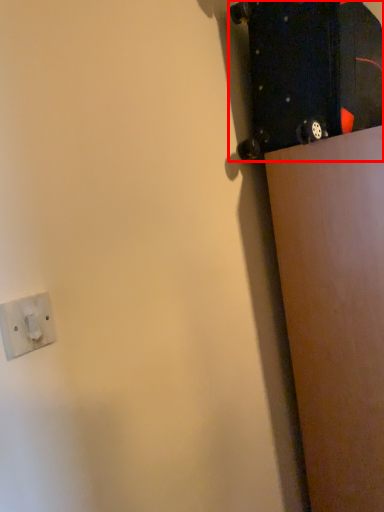
Question: Where is skateboard (annotated by the red box) located in relation to socket in the image?

Choices:
 (A) right
 (B) left

Answer: (A)